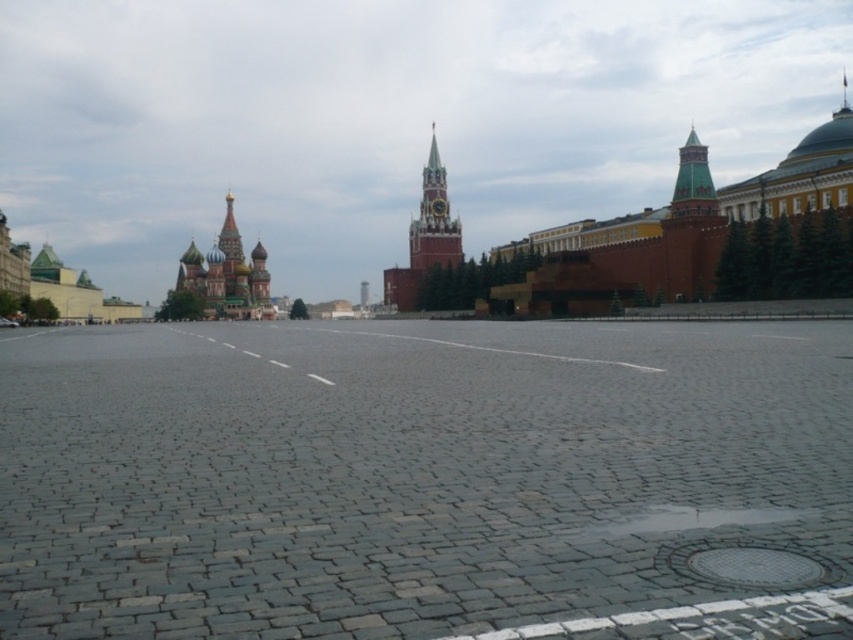
You are an architect visiting Red Square and want to compare the heights of the green copper tower at upper right and the golden domed tower at upper left. Which one is taller?

The golden domed tower at upper left is taller than the green copper tower at upper right.

You are standing at the center of the square and want to take a photo of the green copper tower at upper right. Which direction should you face to ensure the tower is in the frame?

You should face the upper right direction to capture the green copper tower at upper right in your photo, as it is located at point coordinates of (693, 180).

You are an architect analyzing the spatial layout of Red Square. Given the smooth stone clock tower at center and the green copper tower at upper right, which one has a larger footprint when viewed from above?

The smooth stone clock tower at center might be wider than green copper tower at upper right, so it likely has a larger footprint when viewed from above.